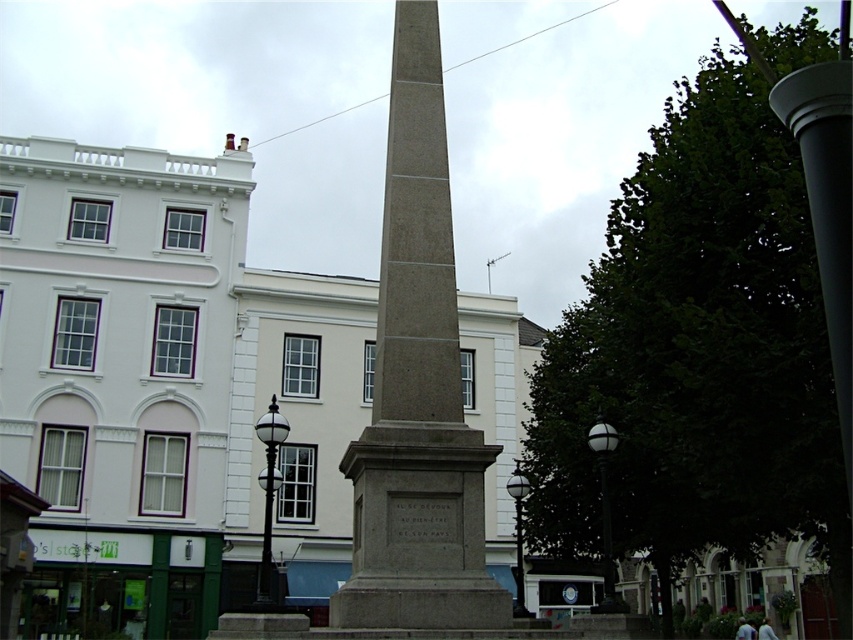
Who is shorter, gray stone obelisk at center or black polished lamp post at center?

black polished lamp post at center

Is gray stone obelisk at center thinner than black polished lamp post at center?

No.

Which is behind, point (457, 420) or point (271, 397)?

Point (271, 397)

The width and height of the screenshot is (853, 640). Identify the location of gray stone obelisk at center. (416, 387).

Can you confirm if black polished lamp post at center is positioned below white glass lamp post at center?

No, black polished lamp post at center is not below white glass lamp post at center.

Does black polished lamp post at center appear on the right side of white glass lamp post at center?

In fact, black polished lamp post at center is to the left of white glass lamp post at center.

Is point (263, 534) farther from camera compared to point (512, 493)?

Yes, it is.

You are a GUI agent. You are given a task and a screenshot of the screen. Output one action in this format:
    pyautogui.click(x=<x>, y=<y>)
    Task: Click on the black polished lamp post at center
    
    Given the screenshot: What is the action you would take?
    pyautogui.click(x=268, y=493)

How much distance is there between white glass lamp post at right and white glass lamp post at center?

7.03 meters

Between white glass lamp post at right and white glass lamp post at center, which one has more height?

With more height is white glass lamp post at right.

This screenshot has height=640, width=853. What are the coordinates of `white glass lamp post at right` in the screenshot? It's located at (605, 513).